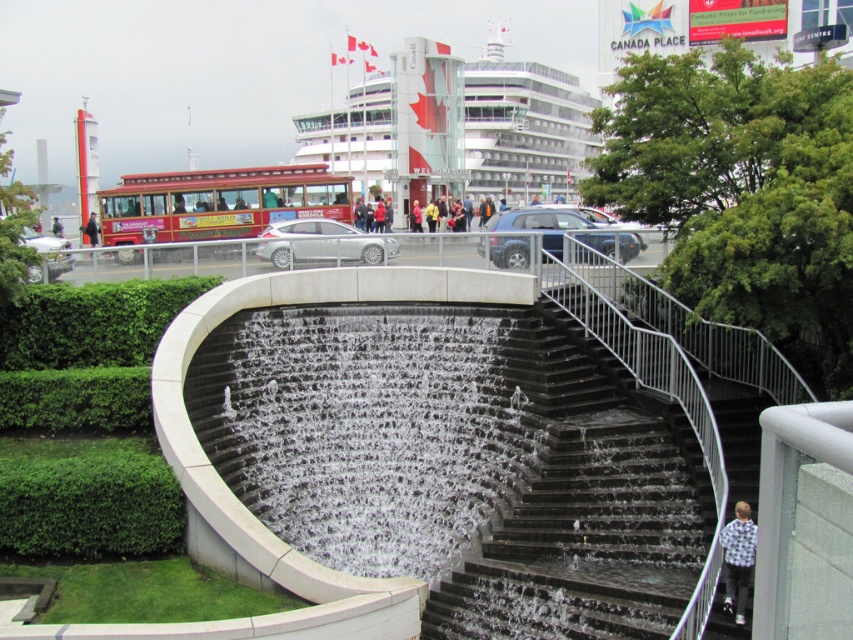
Between black polished stone stairs at center and dark blue jacket at center, which one appears on the left side from the viewer's perspective?

dark blue jacket at center

Can you confirm if black polished stone stairs at center is positioned above dark blue jacket at center?

No, black polished stone stairs at center is not above dark blue jacket at center.

Does point (582, 385) come in front of point (88, 228)?

Yes.

Locate an element on the screen. black polished stone stairs at center is located at coordinates (585, 506).

Which of these two, black polished stone stairs at center or flannel shirt at lower right, stands taller?

black polished stone stairs at center is taller.

Who is shorter, black polished stone stairs at center or flannel shirt at lower right?

flannel shirt at lower right

The height and width of the screenshot is (640, 853). In order to click on black polished stone stairs at center in this screenshot , I will do `click(585, 506)`.

Is flannel shirt at lower right below dark blue jacket at center?

Yes, flannel shirt at lower right is below dark blue jacket at center.

Describe the element at coordinates (737, 560) in the screenshot. This screenshot has width=853, height=640. I see `flannel shirt at lower right` at that location.

Is point (724, 547) positioned after point (93, 228)?

That is False.

Where is `flannel shirt at lower right`? The height and width of the screenshot is (640, 853). flannel shirt at lower right is located at coordinates (737, 560).